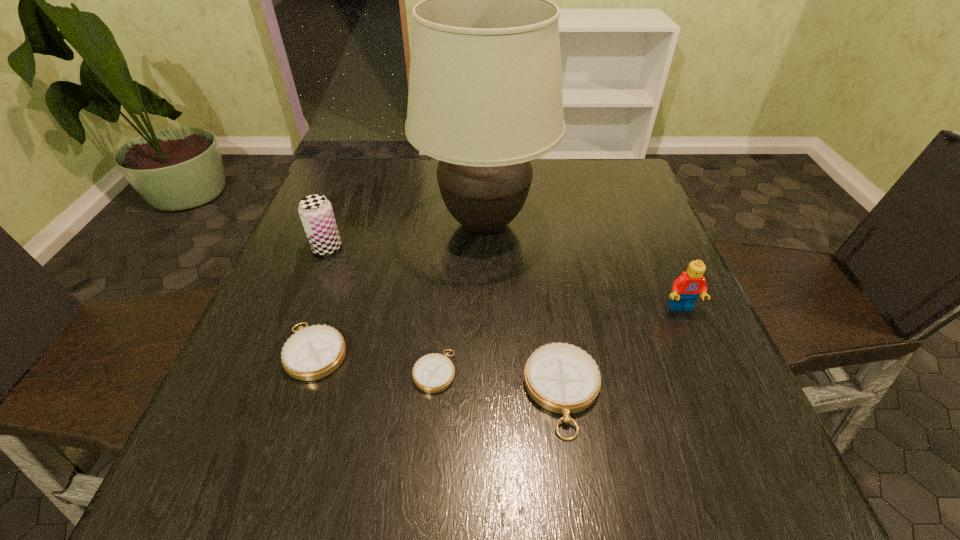
Find the location of a particular element. This screenshot has width=960, height=540. free space located on the right of the shortest object is located at coordinates (528, 371).

The height and width of the screenshot is (540, 960). What are the coordinates of `free space located 0.050m on the right of the rightmost compass` in the screenshot? It's located at (630, 393).

Where is `free space located 0.050m on the front of the beer can`? The width and height of the screenshot is (960, 540). free space located 0.050m on the front of the beer can is located at coordinates (318, 273).

Locate an element on the screen. The image size is (960, 540). free point located 0.210m on the face of the Lego is located at coordinates (726, 410).

Where is `vacant area situated 0.210m on the left of the lampshade`? The width and height of the screenshot is (960, 540). vacant area situated 0.210m on the left of the lampshade is located at coordinates (333, 224).

Locate an element on the screen. object situated at the far edge is located at coordinates (485, 98).

I want to click on compass located at the left edge, so click(x=313, y=352).

I want to click on beer can present at the left edge, so click(x=315, y=211).

Find the location of a particular element. The height and width of the screenshot is (540, 960). object at the right edge is located at coordinates (686, 288).

You are a GUI agent. You are given a task and a screenshot of the screen. Output one action in this format:
    pyautogui.click(x=<x>, y=<y>)
    Task: Click on the free space at the far edge
    Image resolution: width=960 pixels, height=540 pixels.
    Given the screenshot: What is the action you would take?
    pyautogui.click(x=546, y=180)